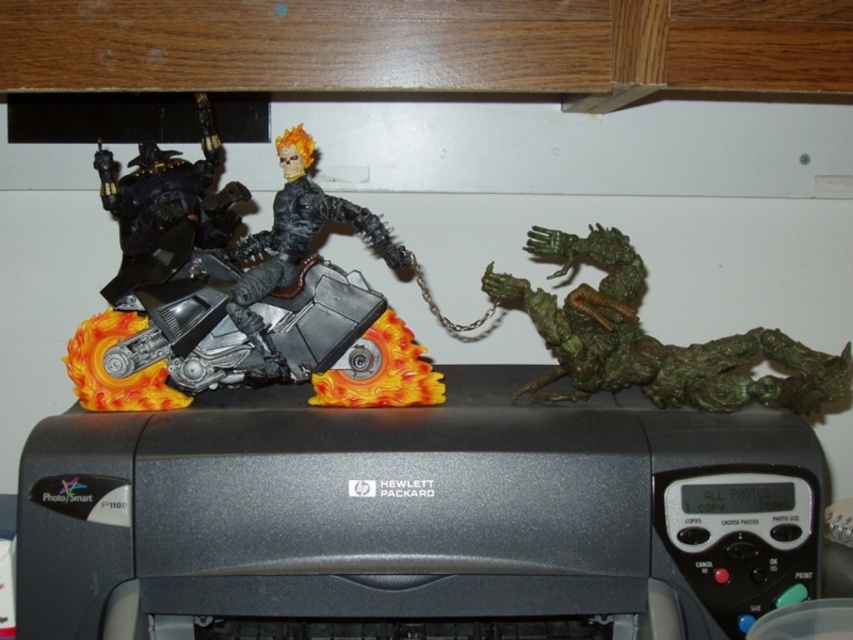
You are standing in front of the Hewlett Packard P1100 printer with two action figures on top. You want to place a new action figure between the two existing points marked as point (x=556, y=356) and point (x=164, y=204). Which point should you place the new figure closer to so that it is in front of the existing figures?

You should place the new action figure closer to point (x=164, y=204) because point (x=556, y=356) is further away from the camera, meaning the point (x=164, y=204) is closer to the viewer and thus in front of the other point.

You are organizing the action figures on the Hewlett Packard P1100 printer. The printer has a digital display panel showing control buttons. Where should you place the green matte dragon at right so it doesn not block the display panel?

The green matte dragon at right is located at point (x=653, y=339), so placing it there would not block the display panel since it is positioned to the right side of the printer.